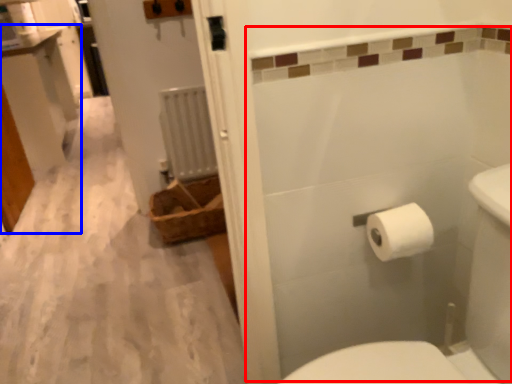
Question: Which object appears closest to the camera in this image, bath (highlighted by a red box) or vanity (highlighted by a blue box)?

Choices:
 (A) bath
 (B) vanity

Answer: (A)